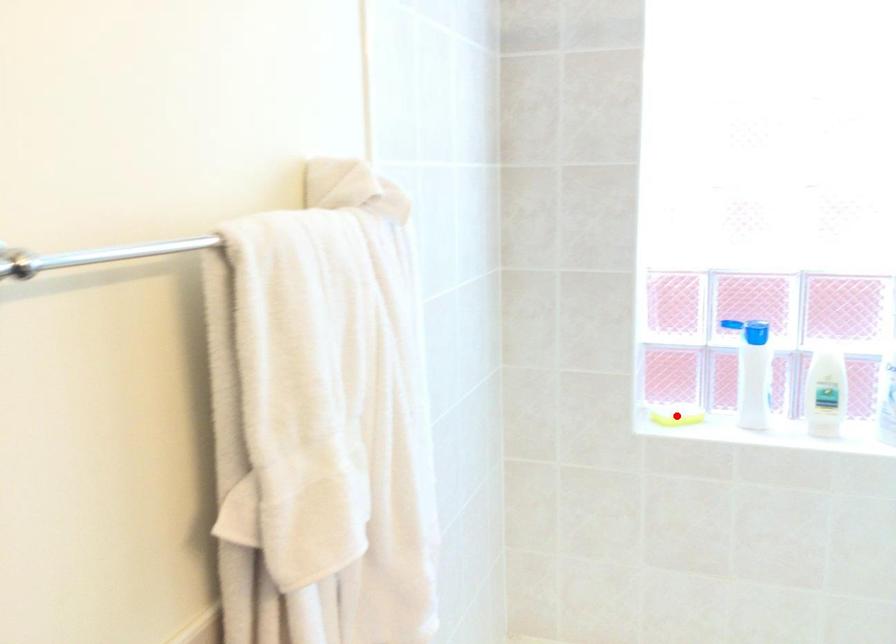
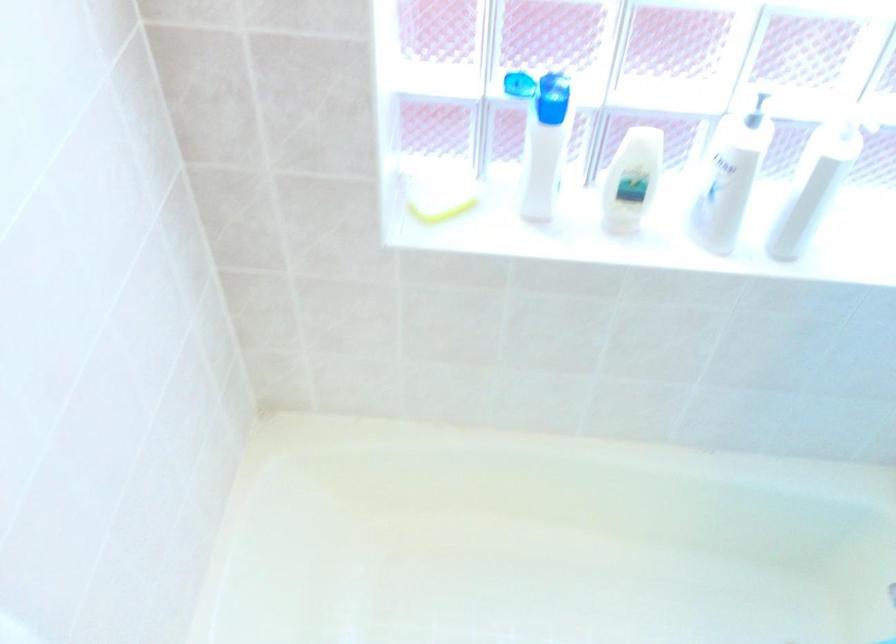
Question: I am providing you with two images of the same scene from different viewpoints. A red point is shown in image1. For the corresponding object point in image2, is it positioned nearer or farther from the camera?

Choices:
 (A) Nearer
 (B) Farther

Answer: (A)